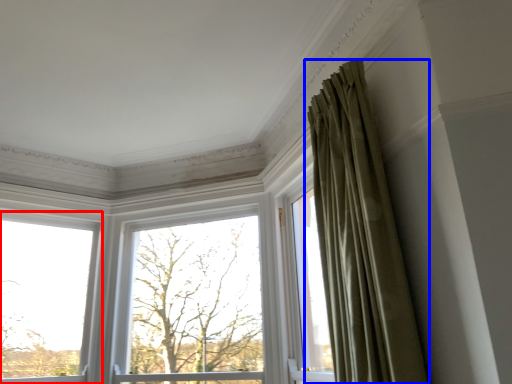
Question: Which point is further to the camera, window (highlighted by a red box) or curtain (highlighted by a blue box)?

Choices:
 (A) window
 (B) curtain

Answer: (A)